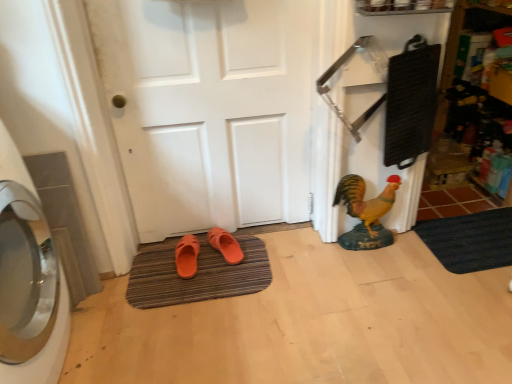
This screenshot has width=512, height=384. In order to click on vacant region in front of shiny yellow statue at right in this screenshot , I will do `click(374, 272)`.